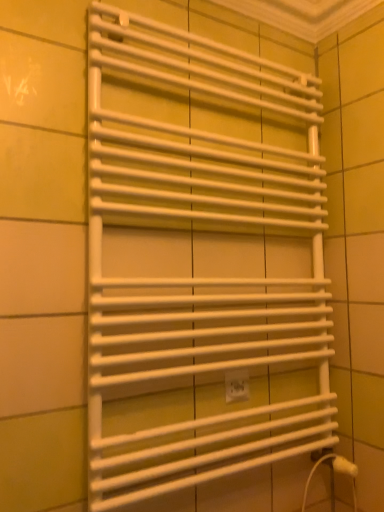
Measure the distance between white matte towel rack at center and camera.

The distance of white matte towel rack at center from camera is 88.73 centimeters.

You are a GUI agent. You are given a task and a screenshot of the screen. Output one action in this format:
    pyautogui.click(x=<x>, y=<y>)
    Task: Click on the white matte towel rack at center
    The width and height of the screenshot is (384, 512).
    Given the screenshot: What is the action you would take?
    pyautogui.click(x=197, y=264)

This screenshot has height=512, width=384. What do you see at coordinates (197, 264) in the screenshot? I see `white matte towel rack at center` at bounding box center [197, 264].

Measure the distance between white plastic electric outlet at center and camera.

white plastic electric outlet at center and camera are 1.15 meters apart.

The image size is (384, 512). What do you see at coordinates (237, 385) in the screenshot?
I see `white plastic electric outlet at center` at bounding box center [237, 385].

At what (x,y) coordinates should I click in order to perform the action: click on white plastic electric outlet at center. Please return your answer as a coordinate pair (x, y). The height and width of the screenshot is (512, 384). Looking at the image, I should click on (237, 385).

The width and height of the screenshot is (384, 512). I want to click on white matte towel rack at center, so click(x=197, y=264).

Considering the relative positions of white plastic electric outlet at center and white matte towel rack at center in the image provided, is white plastic electric outlet at center to the right of white matte towel rack at center from the viewer's perspective?

Correct, you'll find white plastic electric outlet at center to the right of white matte towel rack at center.

Between white plastic electric outlet at center and white matte towel rack at center, which one is positioned behind?

white plastic electric outlet at center is further away from the camera.

Considering the points (234, 384) and (167, 169), which point is behind, point (234, 384) or point (167, 169)?

The point (234, 384) is farther from the camera.

From the image's perspective, relative to white matte towel rack at center, is white plastic electric outlet at center above or below?

Clearly, from the image's perspective, white plastic electric outlet at center is below white matte towel rack at center.

From a real-world perspective, which is physically below, white plastic electric outlet at center or white matte towel rack at center?

In real-world perspective, white plastic electric outlet at center is lower.

In the scene shown: Considering the relative sizes of white plastic electric outlet at center and white matte towel rack at center in the image provided, is white plastic electric outlet at center wider than white matte towel rack at center?

In fact, white plastic electric outlet at center might be narrower than white matte towel rack at center.

In terms of height, does white plastic electric outlet at center look taller or shorter compared to white matte towel rack at center?

Considering their sizes, white plastic electric outlet at center has less height than white matte towel rack at center.

Considering the sizes of objects white plastic electric outlet at center and white matte towel rack at center in the image provided, who is bigger, white plastic electric outlet at center or white matte towel rack at center?

With larger size is white matte towel rack at center.

Is white matte towel rack at center surrounded by white plastic electric outlet at center?

Actually, white matte towel rack at center is outside white plastic electric outlet at center.

Are white plastic electric outlet at center and white matte towel rack at center beside each other?

No, white plastic electric outlet at center is not with white matte towel rack at center.

Is white plastic electric outlet at center positioned with its back to white matte towel rack at center?

That's right, white plastic electric outlet at center is facing away from white matte towel rack at center.

Where is `towel rack above the white plastic electric outlet at center (from the image's perspective)`? towel rack above the white plastic electric outlet at center (from the image's perspective) is located at coordinates (197, 264).

Visually, is white matte towel rack at center positioned to the left or to the right of white plastic electric outlet at center?

white matte towel rack at center is positioned on white plastic electric outlet at center's left side.

Considering their positions, is white matte towel rack at center located in front of or behind white plastic electric outlet at center?

Clearly, white matte towel rack at center is in front of white plastic electric outlet at center.

Does point (277, 169) appear closer or farther from the camera than point (248, 394)?

Point (277, 169) is farther from the camera than point (248, 394).

From the image's perspective, is white matte towel rack at center under white plastic electric outlet at center?

Incorrect, from the image's perspective, white matte towel rack at center is higher than white plastic electric outlet at center.

From a real-world perspective, between white matte towel rack at center and white plastic electric outlet at center, who is vertically lower?

From a 3D spatial view, white plastic electric outlet at center is below.

Is white matte towel rack at center wider or thinner than white plastic electric outlet at center?

Clearly, white matte towel rack at center has more width compared to white plastic electric outlet at center.

From their relative heights in the image, would you say white matte towel rack at center is taller or shorter than white plastic electric outlet at center?

Clearly, white matte towel rack at center is taller compared to white plastic electric outlet at center.

Is white matte towel rack at center smaller than white plastic electric outlet at center?

No, white matte towel rack at center is not smaller than white plastic electric outlet at center.

From the picture: Is white plastic electric outlet at center a part of white matte towel rack at center?

Yes, white matte towel rack at center contains white plastic electric outlet at center.

Is white matte towel rack at center positioned far away from white plastic electric outlet at center?

Actually, white matte towel rack at center and white plastic electric outlet at center are a little close together.

Is white matte towel rack at center aimed at white plastic electric outlet at center?

Yes, white matte towel rack at center is facing white plastic electric outlet at center.

What are the coordinates of `electric outlet directly beneath the white matte towel rack at center (from a real-world perspective)` in the screenshot? It's located at [237, 385].

Find the location of `towel rack in front of the white plastic electric outlet at center`. towel rack in front of the white plastic electric outlet at center is located at coordinates (197, 264).

Locate an element on the screen. towel rack above the white plastic electric outlet at center (from the image's perspective) is located at coordinates (197, 264).